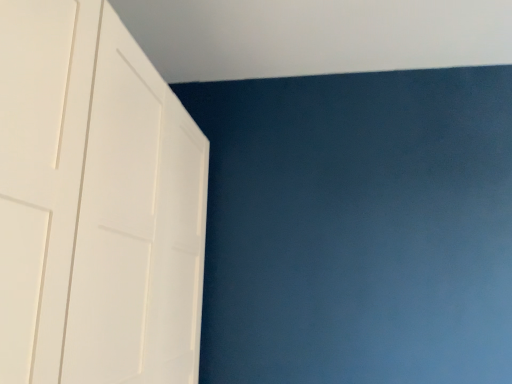
Image resolution: width=512 pixels, height=384 pixels. Describe the element at coordinates (95, 204) in the screenshot. I see `white matte door at left` at that location.

I want to click on white matte door at left, so click(95, 204).

The image size is (512, 384). Find the location of `white matte door at left`. white matte door at left is located at coordinates coord(95,204).